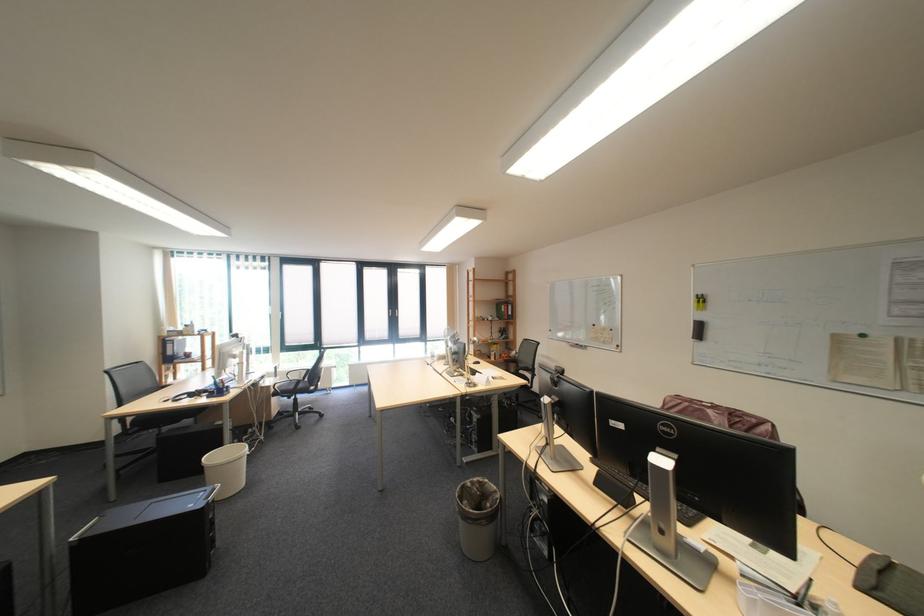
Locate an element on the screen. This screenshot has width=924, height=616. black whiteboard eraser is located at coordinates (698, 330).